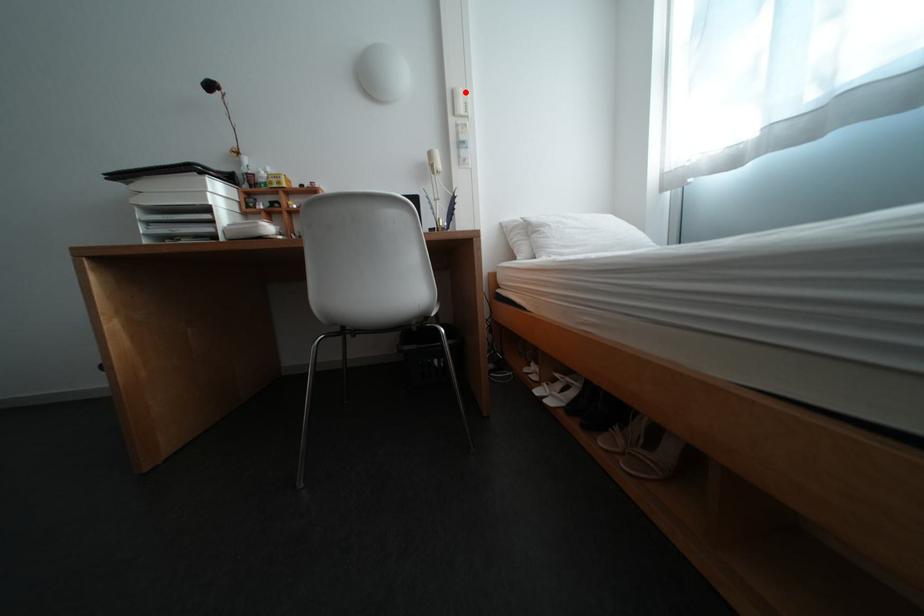
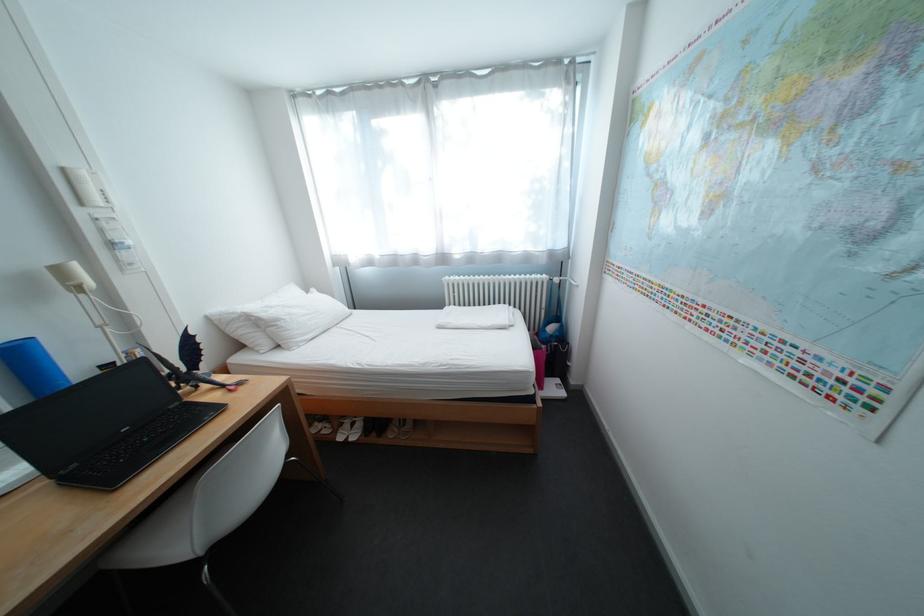
Question: I am providing you with two images of the same scene from different viewpoints. Image1 has a red point marked. In image2, the corresponding 3D location appears at what relative position? Reply with the corresponding letter.

Choices:
 (A) Closer
 (B) Farther

Answer: (B)